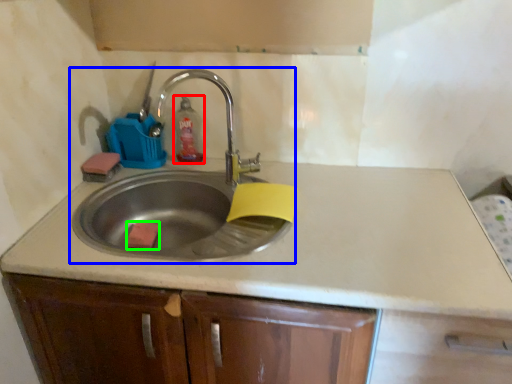
Question: Based on their relative distances, which object is farther from soap dispenser (highlighted by a red box)? Choose from sink (highlighted by a blue box) and soap (highlighted by a green box).

Choices:
 (A) sink
 (B) soap

Answer: (B)